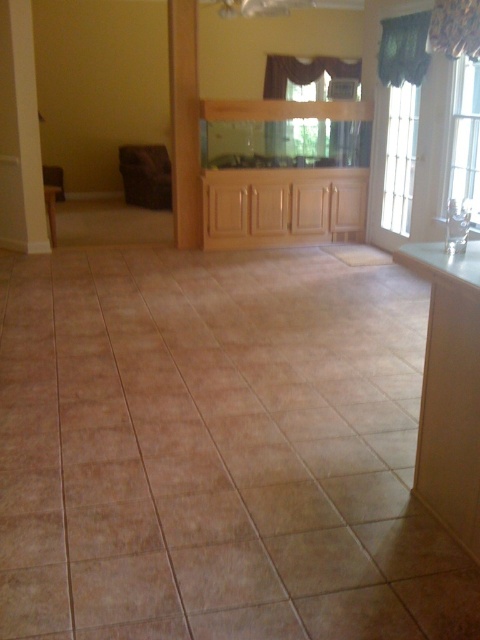
You are an interior designer planning to place a wide sofa between the brown wood pillar at left and the wooden pillar at center. Given that the sofa is 1.5 meters wide, can it fit between them if the space between the pillars is exactly the same as the sofa width?

The brown wood pillar at left is wider than the wooden pillar at center, but the question specifies the space between them is exactly 1.5 meters. Therefore, the sofa can fit as the space matches the sofa width.